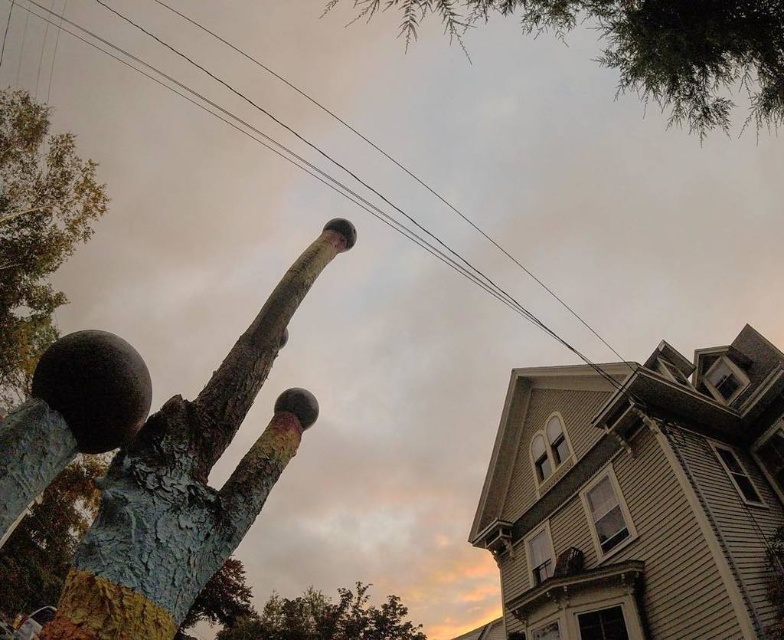
Between rusty metal tree trunk at upper center and green textured leaves at upper center, which one is positioned lower?

rusty metal tree trunk at upper center is below.

At what (x,y) coordinates should I click in order to perform the action: click on rusty metal tree trunk at upper center. Please return your answer as a coordinate pair (x, y). The width and height of the screenshot is (784, 640). Looking at the image, I should click on (191, 481).

Is point (249, 467) closer to camera compared to point (645, 93)?

Yes, it is in front of point (645, 93).

Locate an element on the screen. This screenshot has height=640, width=784. rusty metal tree trunk at upper center is located at coordinates (191, 481).

Does green leafy tree at upper left have a greater height compared to black wire at upper center?

No, green leafy tree at upper left is not taller than black wire at upper center.

Can you confirm if green leafy tree at upper left is wider than black wire at upper center?

In fact, green leafy tree at upper left might be narrower than black wire at upper center.

Is point (98, 202) closer to viewer compared to point (285, 152)?

That is True.

In order to click on green leafy tree at upper left in this screenshot , I will do `click(35, 227)`.

Is black wire at upper center thinner than green leafy tree at lower center?

In fact, black wire at upper center might be wider than green leafy tree at lower center.

Does black wire at upper center come behind green leafy tree at lower center?

No, it is in front of green leafy tree at lower center.

The width and height of the screenshot is (784, 640). Identify the location of black wire at upper center. (296, 157).

Image resolution: width=784 pixels, height=640 pixels. Find the location of `black wire at upper center`. black wire at upper center is located at coordinates (296, 157).